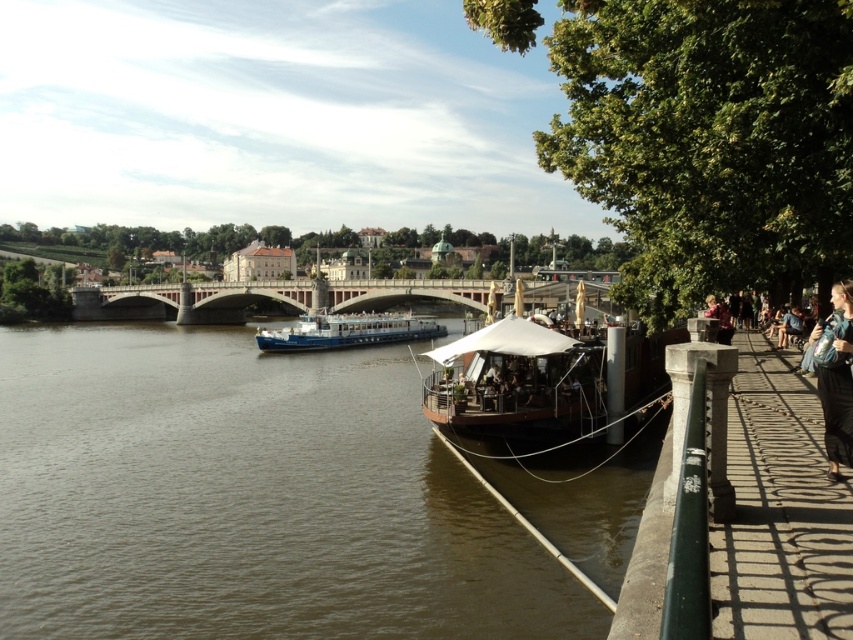
Question: Which of these objects is positioned farthest from the white canvas boat at center?

Choices:
 (A) blue polished wood boat at center
 (B) concrete bridge at center
 (C) blue denim jacket at lower right
 (D) brown water at center

Answer: (A)

Question: Can you confirm if concrete bridge at center is smaller than blue denim jacket at lower right?

Choices:
 (A) no
 (B) yes

Answer: (A)

Question: Does brown water at center have a smaller size compared to blue polished wood boat at center?

Choices:
 (A) no
 (B) yes

Answer: (A)

Question: Where is brown water at center located in relation to blue denim jacket at lower right in the image?

Choices:
 (A) right
 (B) left

Answer: (B)

Question: Which of the following is the closest to the observer?

Choices:
 (A) (840, 330)
 (B) (143, 474)
 (C) (404, 284)
 (D) (469, 344)

Answer: (A)

Question: Which of the following is the closest to the observer?

Choices:
 (A) white canvas boat at center
 (B) blue polished wood boat at center
 (C) concrete bridge at center
 (D) brown water at center

Answer: (D)